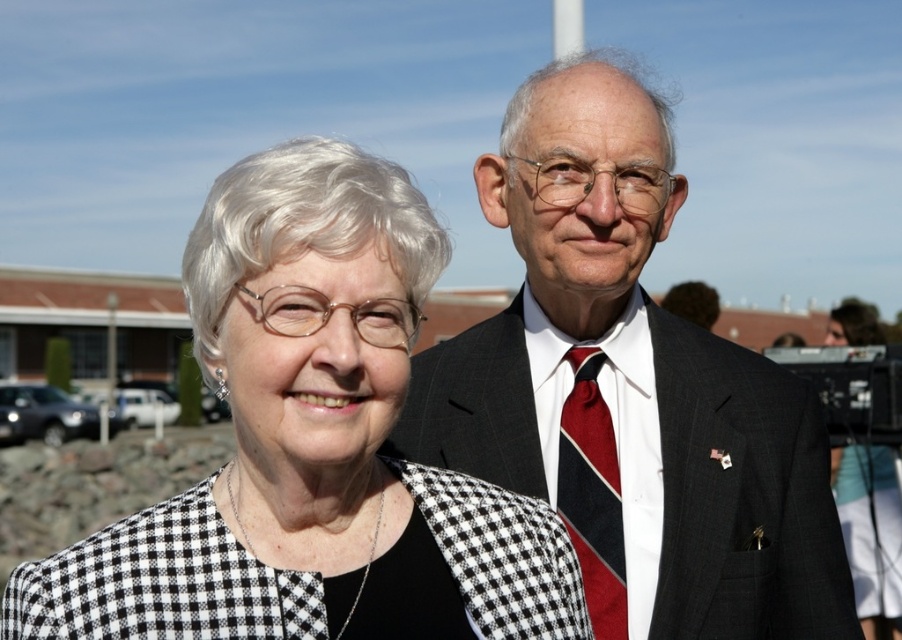
Identify the location of dark gray suit at center. This screenshot has height=640, width=902. (631, 394).

This screenshot has width=902, height=640. I want to click on dark gray suit at center, so click(x=631, y=394).

The height and width of the screenshot is (640, 902). What are the coordinates of `dark gray suit at center` in the screenshot? It's located at (631, 394).

Who is more distant from viewer, (412,330) or (559,499)?

Point (559,499)

Can you confirm if black checkered blazer at center is positioned to the left of red striped tie at center?

Indeed, black checkered blazer at center is positioned on the left side of red striped tie at center.

Between point (287, 236) and point (618, 474), which one is positioned behind?

The point (618, 474) is behind.

This screenshot has height=640, width=902. Identify the location of black checkered blazer at center. (311, 445).

Identify the location of black checkered blazer at center. (311, 445).